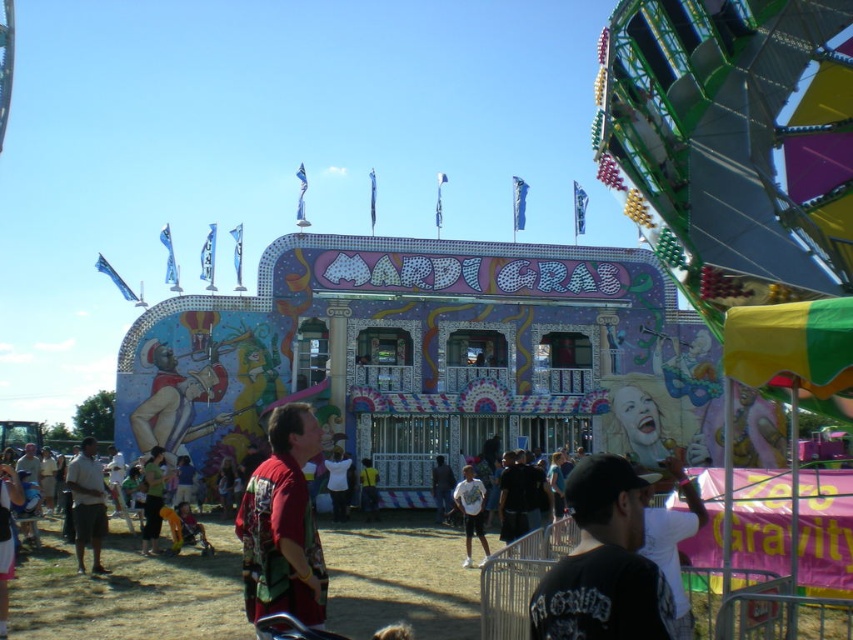
You are a photographer standing in front of the Mardi Gras building. You notice two items in your viewfinder. One is dark gray shorts at lower left and the other is white matte shirt at center. Which item appears taller in the photo?

The dark gray shorts at lower left appears taller than the white matte shirt at center in the photo.